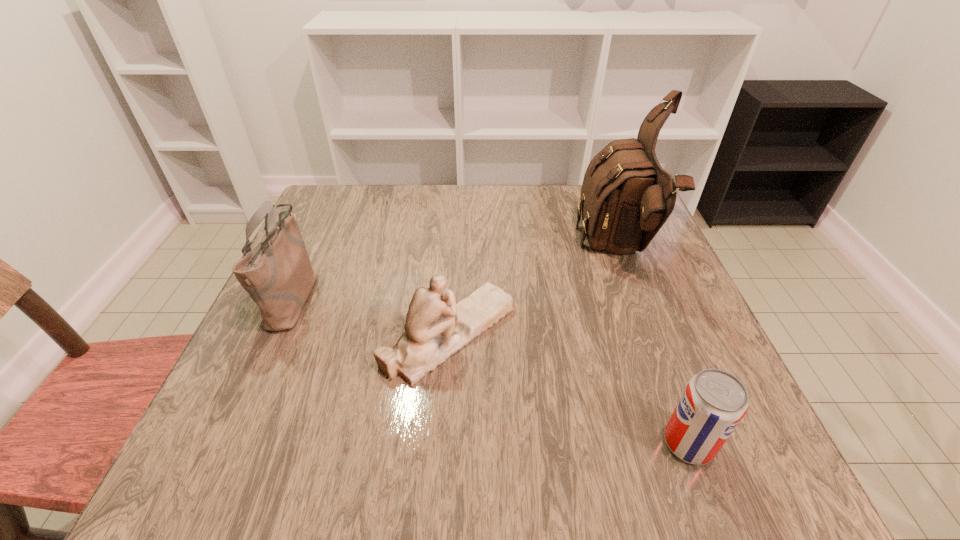
You are a GUI agent. You are given a task and a screenshot of the screen. Output one action in this format:
    pyautogui.click(x=<x>, y=<y>)
    Task: Click on the free spot at the near edge of the desktop
    The image size is (960, 540).
    Given the screenshot: What is the action you would take?
    pyautogui.click(x=475, y=464)

In the image, there is a desktop. At what (x,y) coordinates should I click in order to perform the action: click on vacant area at the left edge. Please return your answer as a coordinate pair (x, y). The height and width of the screenshot is (540, 960). Looking at the image, I should click on (319, 236).

At what (x,y) coordinates should I click in order to perform the action: click on vacant area at the right edge. Please return your answer as a coordinate pair (x, y). Image resolution: width=960 pixels, height=540 pixels. Looking at the image, I should click on (684, 326).

You are a GUI agent. You are given a task and a screenshot of the screen. Output one action in this format:
    pyautogui.click(x=<x>, y=<y>)
    Task: Click on the vacant space at the far left corner
    The height and width of the screenshot is (540, 960).
    Given the screenshot: What is the action you would take?
    pyautogui.click(x=341, y=201)

I want to click on vacant region at the near left corner of the desktop, so click(x=187, y=485).

This screenshot has width=960, height=540. In order to click on empty space between the third object from right to left and the third shortest object in this screenshot , I will do `click(372, 315)`.

Where is `vacant space that's between the right shoulder bag and the leftmost object`? The width and height of the screenshot is (960, 540). vacant space that's between the right shoulder bag and the leftmost object is located at coordinates (456, 273).

The width and height of the screenshot is (960, 540). In order to click on free space between the nearest object and the leftmost object in this screenshot , I will do `click(492, 370)`.

Locate an element on the screen. unoccupied position between the nearest object and the taller shoulder bag is located at coordinates (654, 347).

Identify the location of empty space between the figurine and the taller shoulder bag. The image size is (960, 540). (534, 292).